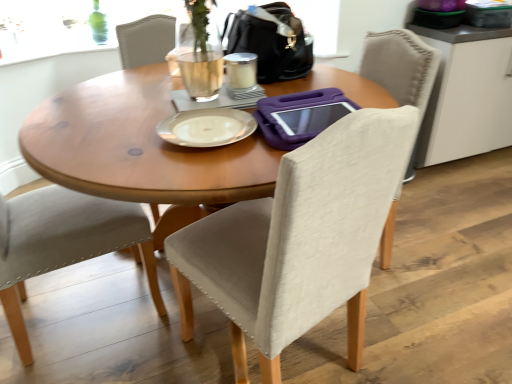
The width and height of the screenshot is (512, 384). I want to click on free point to the right of beige fabric chair at center, the 1th chair when ordered from right to left, so click(420, 324).